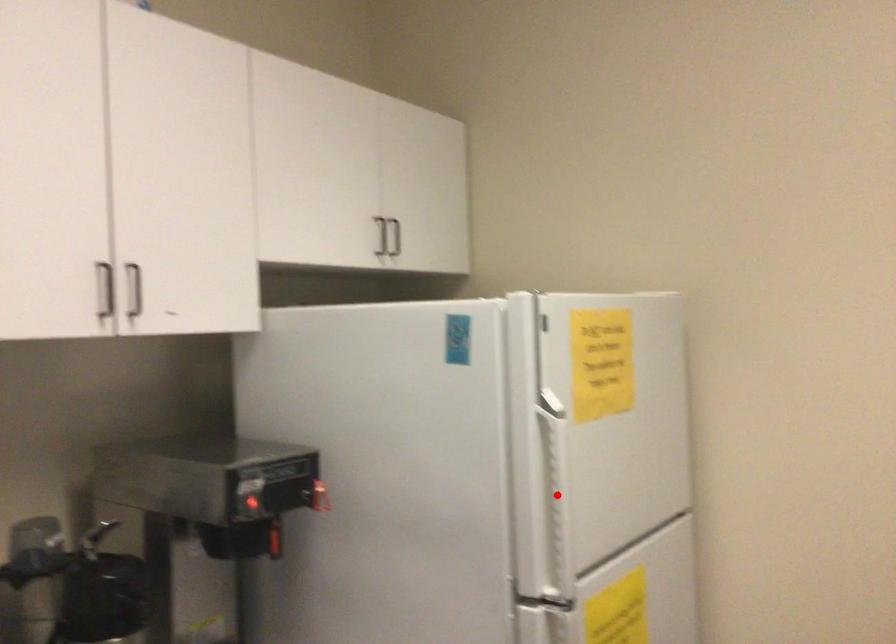
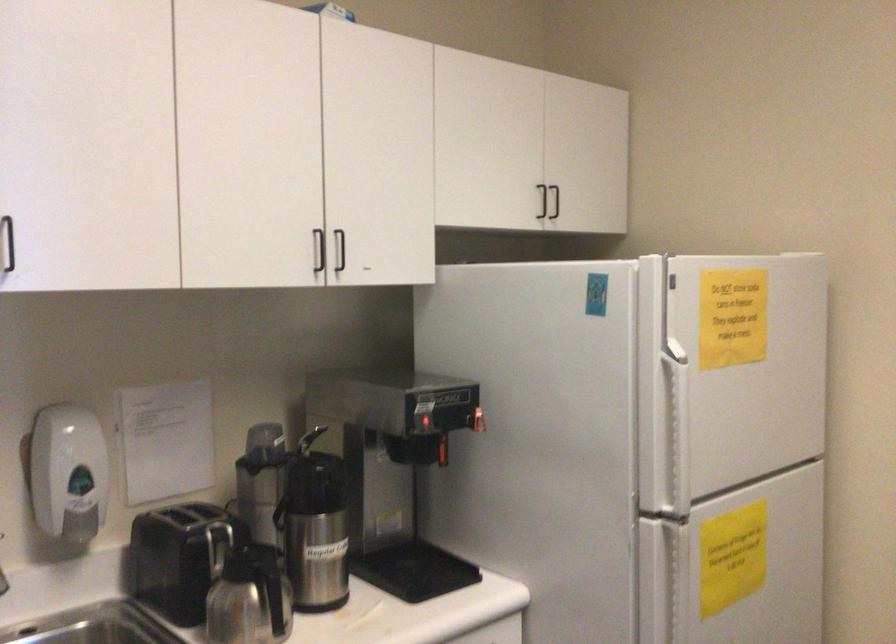
The point at the highlighted location is marked in the first image. Where is the corresponding point in the second image?

(675, 431)